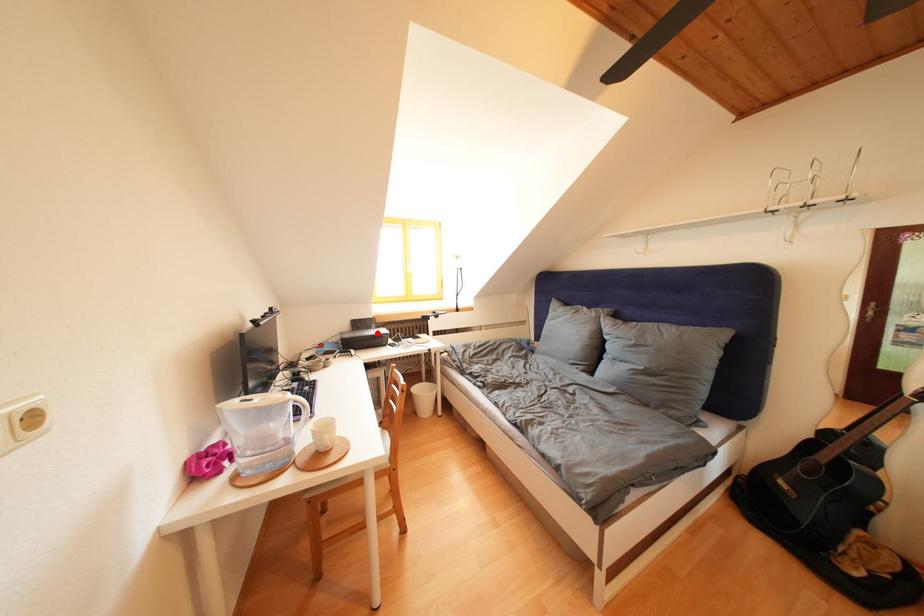
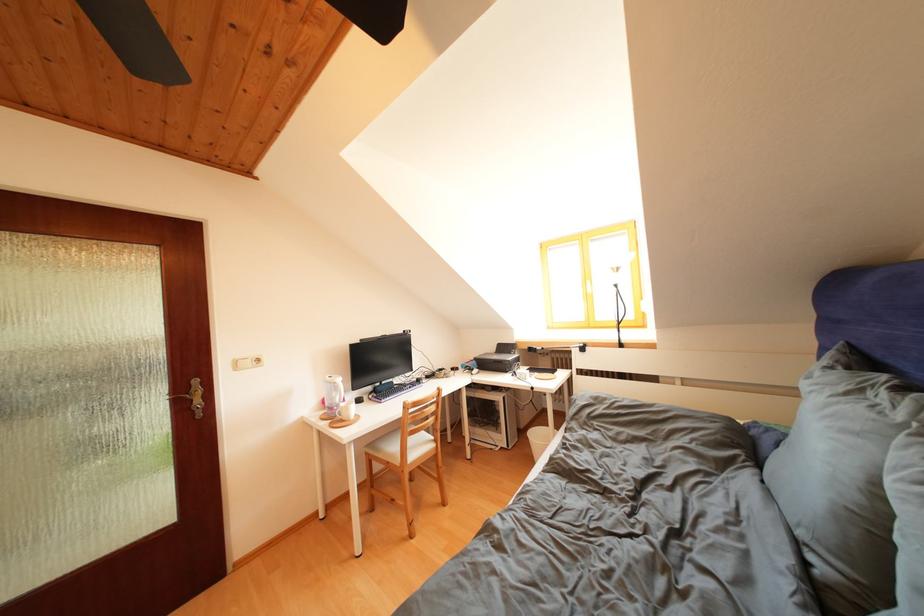
Question: I am providing you with two images of the same scene from different viewpoints. In image1, a red point is highlighted. Considering the same 3D point in image2, which of the following is correct?

Choices:
 (A) It is closer
 (B) It is farther

Answer: (B)